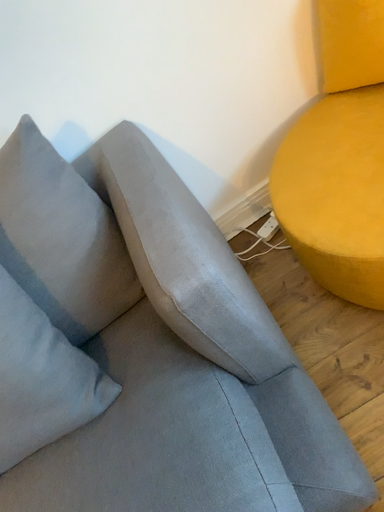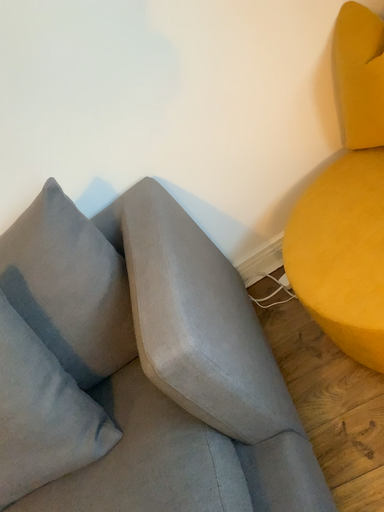
Question: How did the camera likely rotate when shooting the video?

Choices:
 (A) rotated left
 (B) rotated right

Answer: (A)